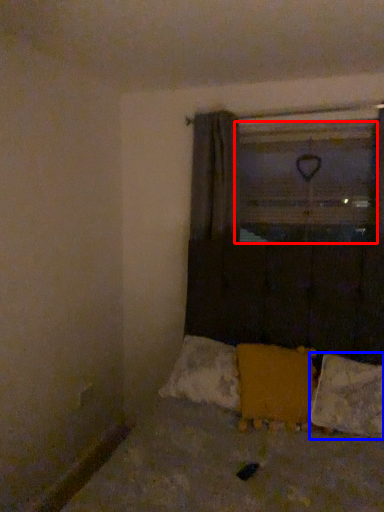
Question: Which object is closer to the camera taking this photo, window screen (highlighted by a red box) or pillow (highlighted by a blue box)?

Choices:
 (A) window screen
 (B) pillow

Answer: (B)